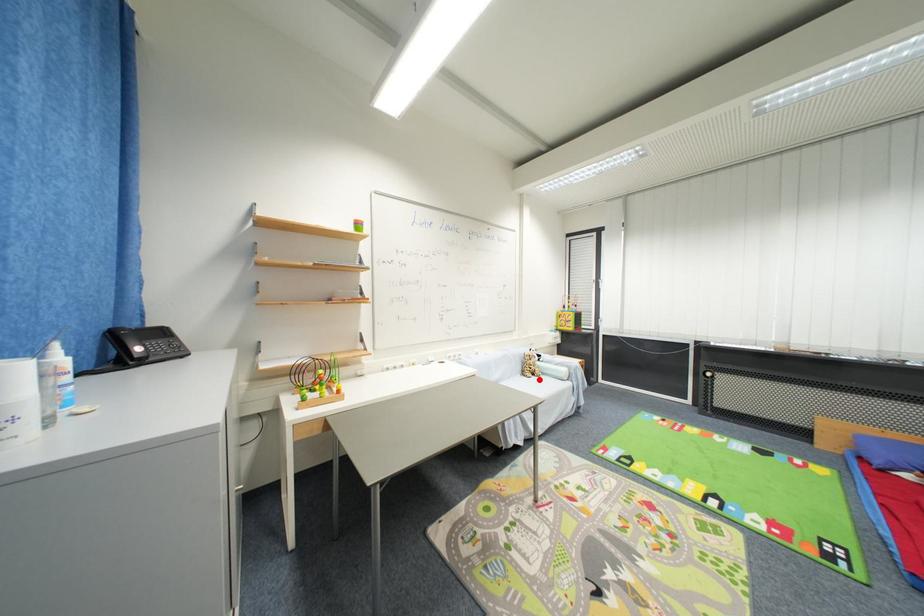
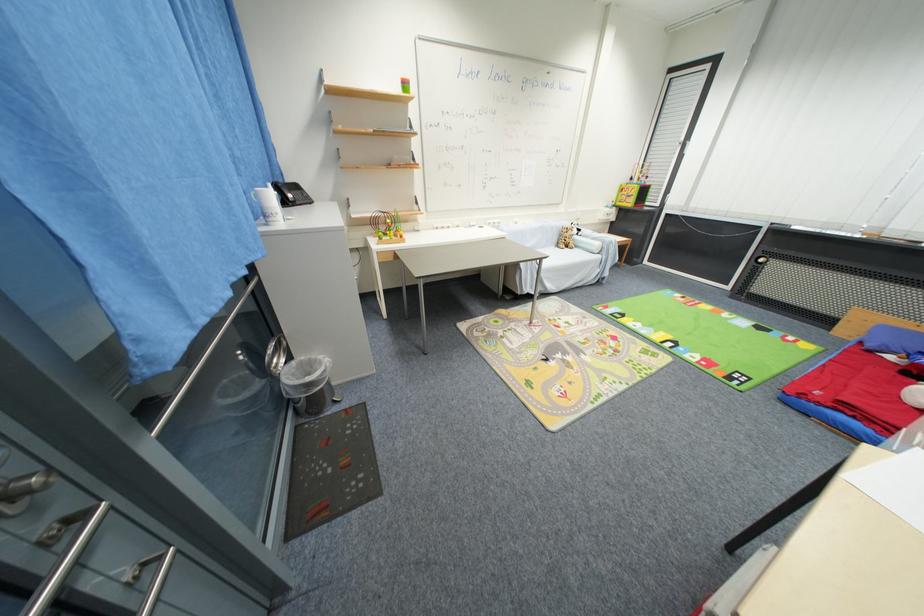
Question: I am providing you with two images of the same scene from different viewpoints. Given a red point in image1, look at the same physical point in image2. Is it:

Choices:
 (A) Closer to the viewpoint
 (B) Farther from the viewpoint

Answer: (B)